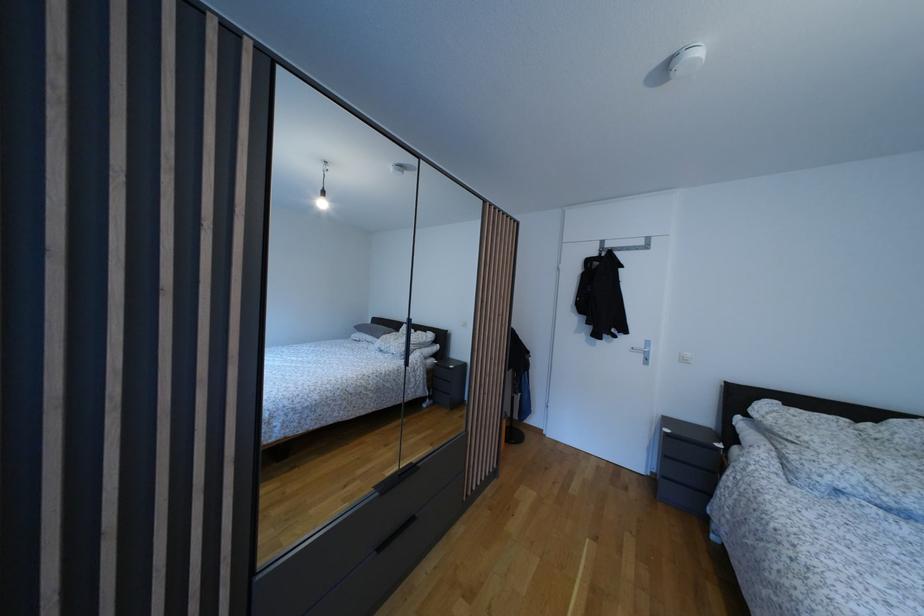
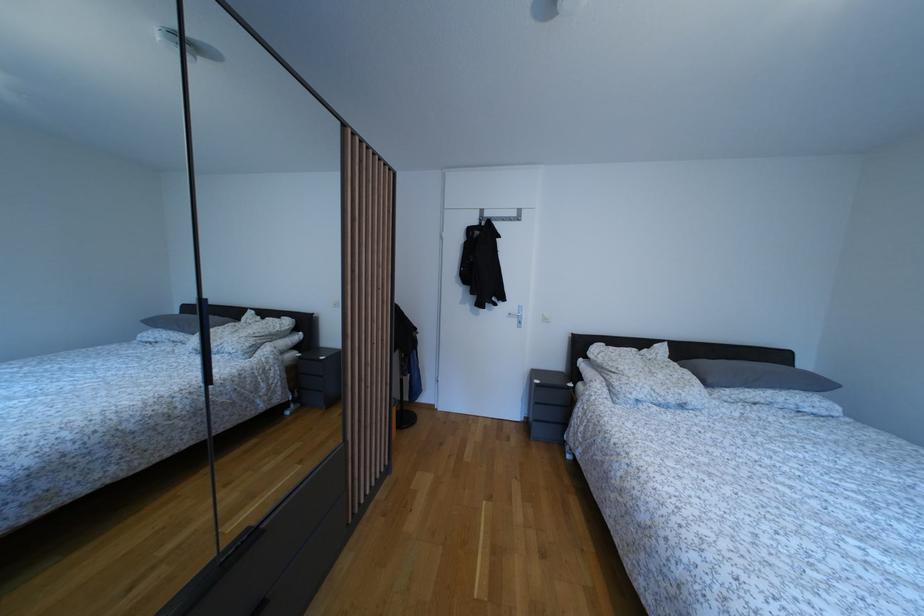
Where in the second image is the point corresponding to the point at 419,469 from the first image?

(254, 535)